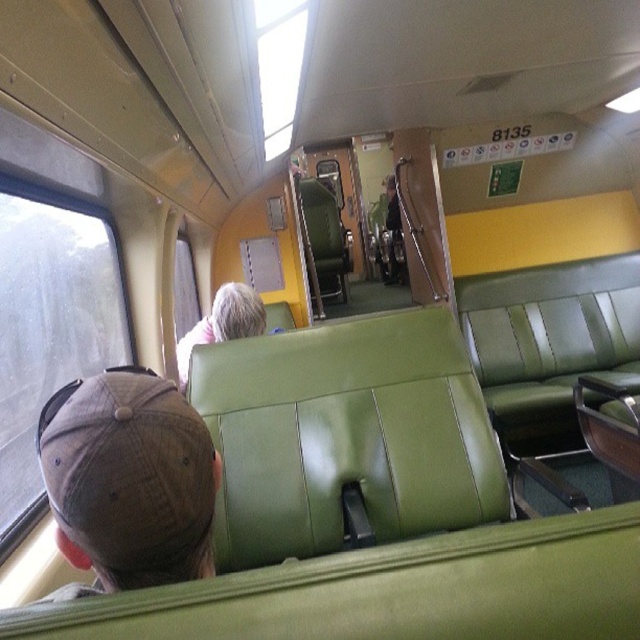
Does transparent glass window at left come behind gray matte hair at center?

No, transparent glass window at left is closer to the viewer.

Is point (38, 291) closer to camera compared to point (182, 358)?

Yes, it is in front of point (182, 358).

The width and height of the screenshot is (640, 640). What do you see at coordinates (49, 326) in the screenshot? I see `transparent glass window at left` at bounding box center [49, 326].

Identify the location of transparent glass window at left. (49, 326).

Is brown fabric baseball cap at lower left taller than gray matte hair at center?

Incorrect, brown fabric baseball cap at lower left's height is not larger of gray matte hair at center's.

Does point (61, 477) lie behind point (243, 314)?

No, it is in front of (243, 314).

I want to click on brown fabric baseball cap at lower left, so click(128, 472).

Which is below, brown fabric baseball cap at lower left or transparent glass window at upper center?

brown fabric baseball cap at lower left

You are a GUI agent. You are given a task and a screenshot of the screen. Output one action in this format:
    pyautogui.click(x=<x>, y=<y>)
    Task: Click on the brown fabric baseball cap at lower left
    The image size is (640, 640).
    Given the screenshot: What is the action you would take?
    pyautogui.click(x=128, y=472)